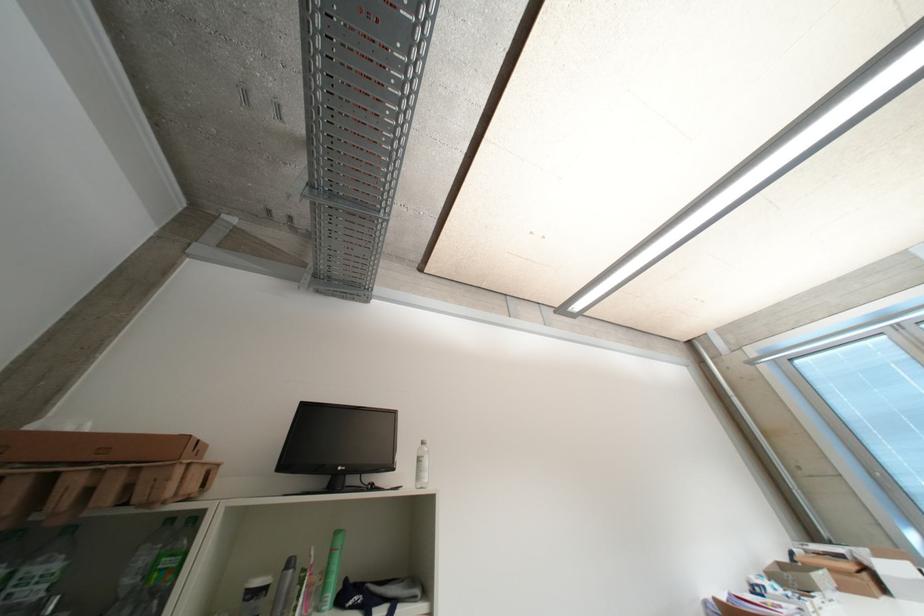
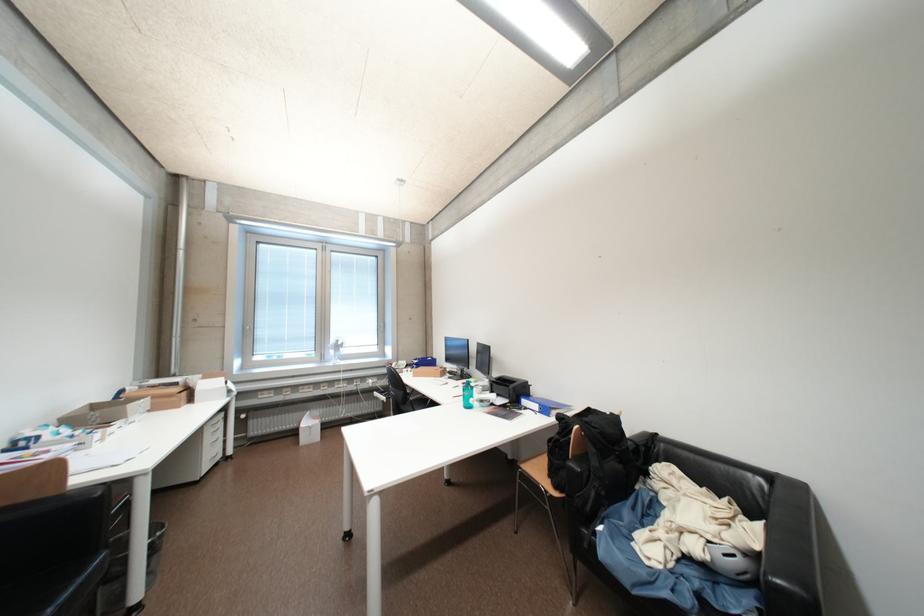
In the second image, find the point that corresponds to point 850,559 in the first image.

(184, 386)